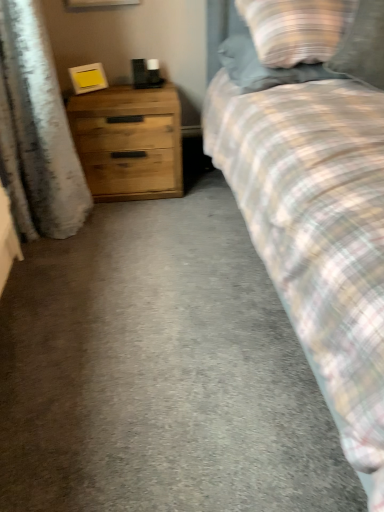
Locate an element on the screen. vacant space situated above wooden chest of drawers at left (from a real-world perspective) is located at coordinates (128, 93).